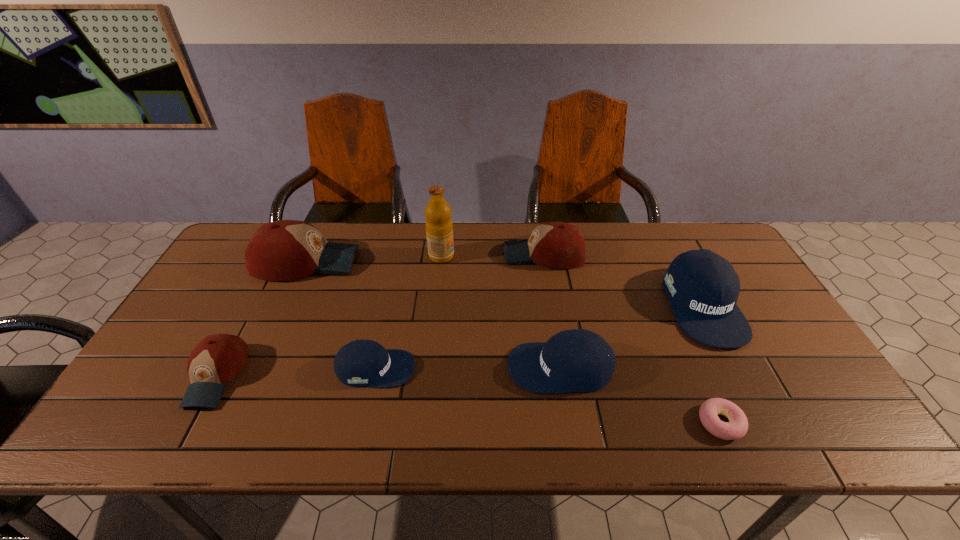
At what (x,y) coordinates should I click in order to perform the action: click on vacant space positioned on the front-facing side of the smallest blue baseball cap. Please return your answer as a coordinate pair (x, y). Looking at the image, I should click on (455, 369).

This screenshot has height=540, width=960. I want to click on vacant region located 0.310m on the left of the shortest object, so click(x=561, y=423).

At what (x,y) coordinates should I click in order to perform the action: click on fruit juice that is at the far edge. Please return your answer as a coordinate pair (x, y). Image resolution: width=960 pixels, height=540 pixels. Looking at the image, I should click on (439, 228).

Find the location of `baseball cap present at the near edge`. baseball cap present at the near edge is located at coordinates (217, 359).

Identify the location of doughnut positioned at the near edge. The image size is (960, 540). (736, 428).

What are the coordinates of `object at the right edge` in the screenshot? It's located at (703, 287).

Identify the location of object that is at the far left corner. (285, 250).

This screenshot has width=960, height=540. I want to click on object located at the near left corner, so click(x=217, y=359).

The height and width of the screenshot is (540, 960). In the image, there is a desktop. Identify the location of vacant region at the far edge. (628, 255).

In the image, there is a desktop. At what (x,y) coordinates should I click in order to perform the action: click on vacant space at the left edge. Please return your answer as a coordinate pair (x, y). Looking at the image, I should click on (239, 294).